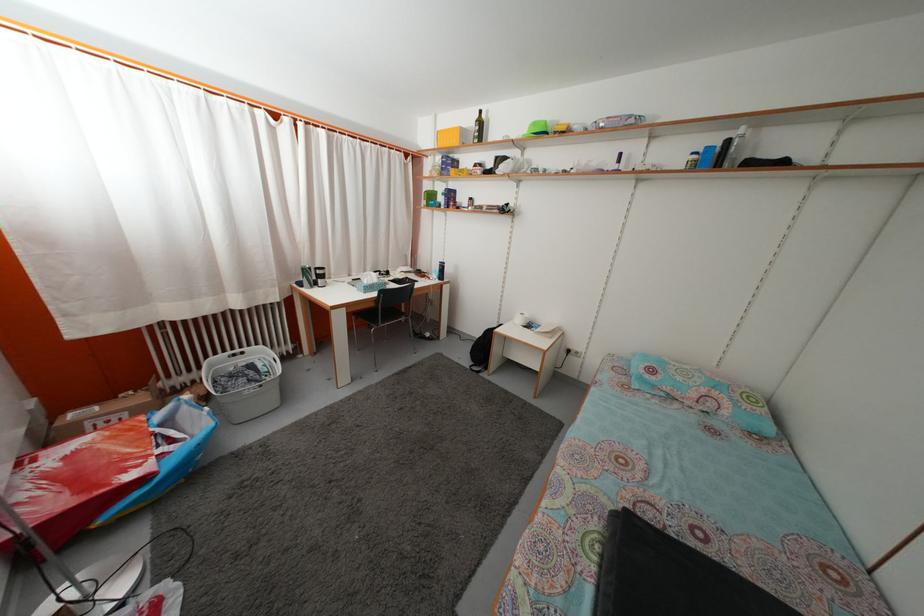
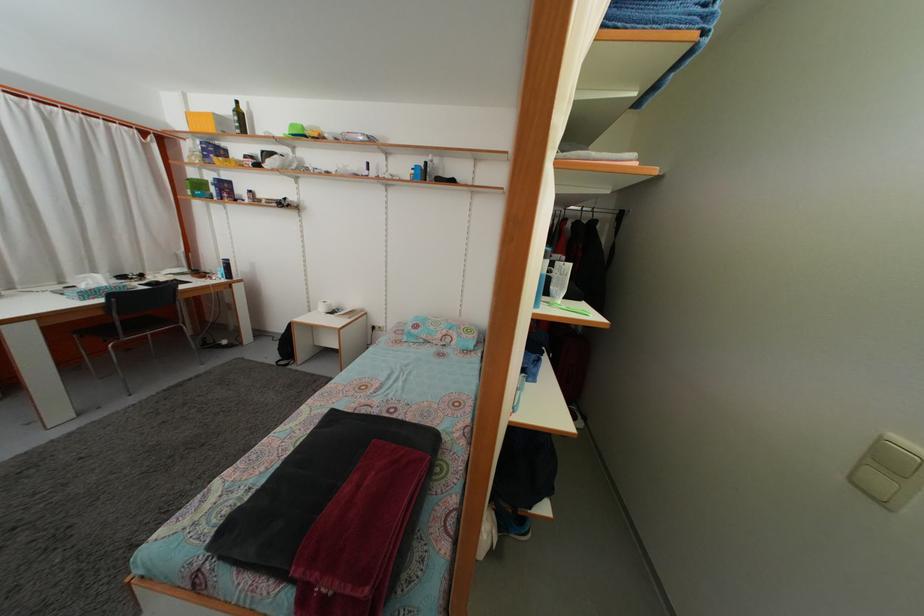
In the second image, find the point that corresponds to pixel 444 142 in the first image.

(196, 123)